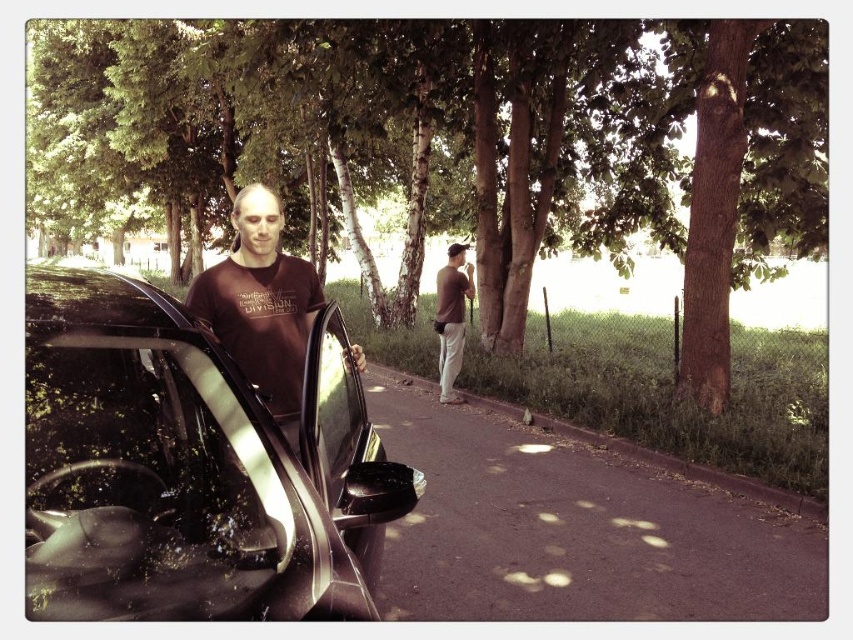
Question: Does brown textured tree at center appear under brown cotton shirt at center?

Choices:
 (A) yes
 (B) no

Answer: (B)

Question: Is brown textured tree at center bigger than shiny black car at left?

Choices:
 (A) yes
 (B) no

Answer: (A)

Question: Which is farther from the brown textured tree at center?

Choices:
 (A) brown cotton shirt at center
 (B) shiny black car at left
 (C) matte brown t-shirt at center

Answer: (C)

Question: Can you confirm if shiny black car at left is positioned above brown cotton shirt at center?

Choices:
 (A) yes
 (B) no

Answer: (B)

Question: Which is farther from the brown cotton shirt at center?

Choices:
 (A) shiny black car at left
 (B) matte brown t-shirt at center

Answer: (A)

Question: Which is nearer to the matte brown t-shirt at center?

Choices:
 (A) shiny black car at left
 (B) brown textured tree at center
 (C) brown cotton shirt at center

Answer: (A)